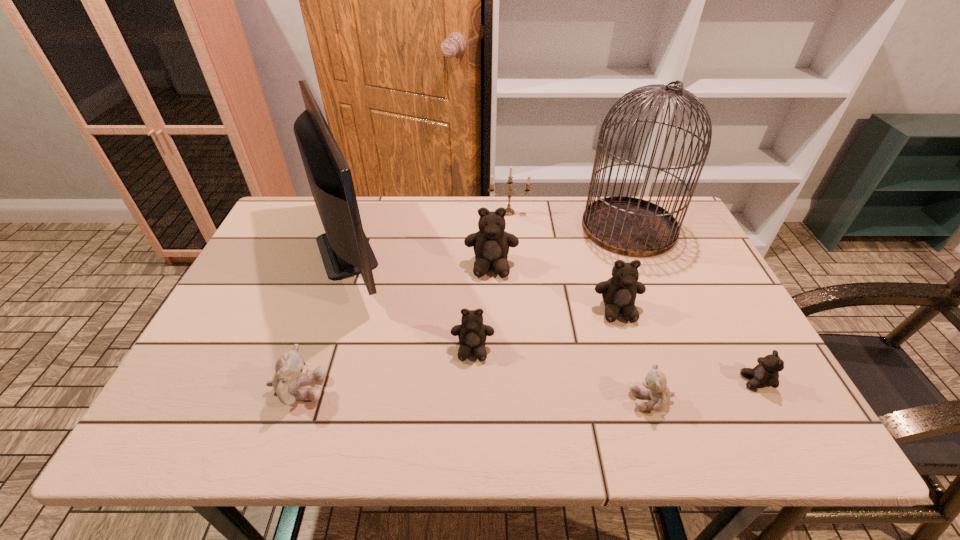
Locate which object is the eighth closest to the computer monitor. Please provide its 2D coordinates. Your answer should be formatted as a tuple, i.e. [(x, y)], where the tuple contains the x and y coordinates of a point satisfying the conditions above.

[(765, 374)]

I want to click on the fourth closest object to the right gray teddy bear, so pyautogui.click(x=491, y=243).

Where is `the second closest teddy bear to the smaller gray teddy bear`? Image resolution: width=960 pixels, height=540 pixels. the second closest teddy bear to the smaller gray teddy bear is located at coordinates (619, 292).

Where is `the fourth closest teddy bear to the biggest brown teddy bear`? the fourth closest teddy bear to the biggest brown teddy bear is located at coordinates (291, 372).

Identify which brown teddy bear is located as the third nearest to the right gray teddy bear. Please provide its 2D coordinates. Your answer should be formatted as a tuple, i.e. [(x, y)], where the tuple contains the x and y coordinates of a point satisfying the conditions above.

[(472, 333)]

This screenshot has height=540, width=960. Identify the location of the closest brown teddy bear to the metallic candle. (491, 243).